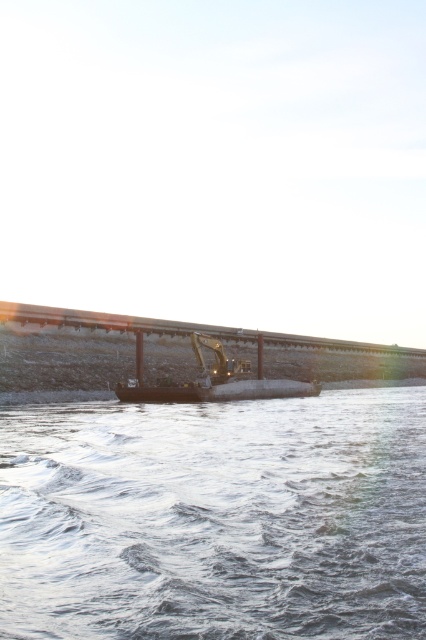
From the picture: Between clear water at lower center and concrete bridge at center, which one is positioned higher?

Positioned higher is concrete bridge at center.

Consider the image. Is clear water at lower center positioned behind concrete bridge at center?

That is False.

Is point (34, 616) positioned behind point (247, 342)?

No, it is in front of (247, 342).

You are a GUI agent. You are given a task and a screenshot of the screen. Output one action in this format:
    pyautogui.click(x=<x>, y=<y>)
    Task: Click on the clear water at lower center
    Image resolution: width=426 pixels, height=640 pixels.
    Given the screenshot: What is the action you would take?
    pyautogui.click(x=215, y=518)

Is point (149, 480) positioned after point (238, 378)?

No, (149, 480) is closer to viewer.

Who is taller, clear water at lower center or metallic yellow excavator at center?

Standing taller between the two is metallic yellow excavator at center.

Consider the image. Who is more forward, (419, 576) or (213, 400)?

Point (419, 576) is more forward.

The width and height of the screenshot is (426, 640). I want to click on clear water at lower center, so click(x=215, y=518).

Is concrete bridge at center wider than metallic yellow excavator at center?

Yes.

Can you confirm if concrete bridge at center is taller than metallic yellow excavator at center?

Yes, concrete bridge at center is taller than metallic yellow excavator at center.

Describe the element at coordinates (100, 346) in the screenshot. I see `concrete bridge at center` at that location.

You are a GUI agent. You are given a task and a screenshot of the screen. Output one action in this format:
    pyautogui.click(x=<x>, y=<y>)
    Task: Click on the concrete bridge at center
    
    Given the screenshot: What is the action you would take?
    pyautogui.click(x=100, y=346)